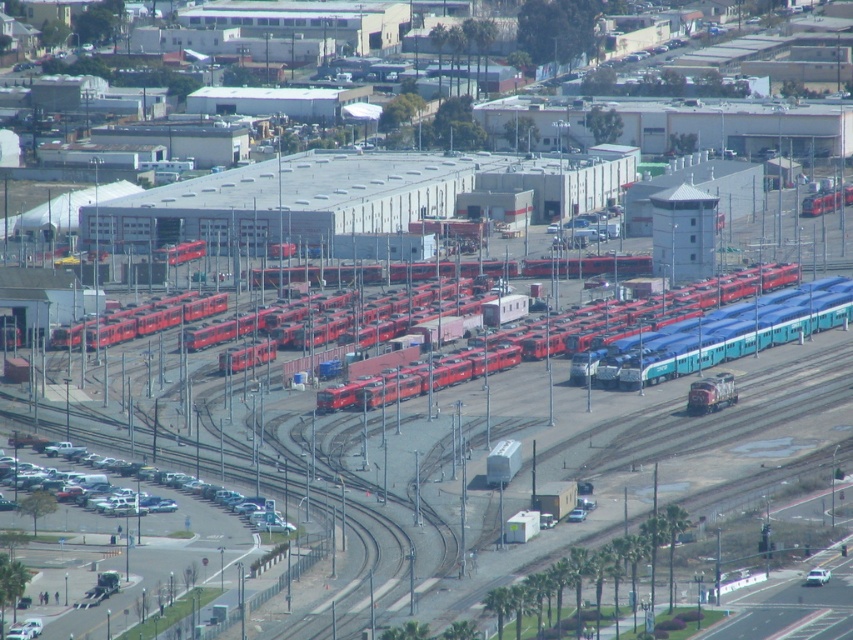
Question: Is matte red train at left positioned at the back of reddish-brown metallic train car at lower right?

Choices:
 (A) no
 (B) yes

Answer: (A)

Question: Which point is farther from the camera taking this photo?

Choices:
 (A) (525, 344)
 (B) (810, 321)
 (C) (726, 401)
 (D) (78, 330)

Answer: (B)

Question: Can you confirm if matte red train at center is wider than matte red train at left?

Choices:
 (A) yes
 (B) no

Answer: (A)

Question: Does matte red train at center appear on the right side of reddish-brown metallic train car at lower right?

Choices:
 (A) no
 (B) yes

Answer: (A)

Question: Which object is closer to the camera taking this photo?

Choices:
 (A) matte red train at left
 (B) reddish-brown metallic train car at lower right
 (C) red glossy train at center

Answer: (A)

Question: Which point is farther to the camera?

Choices:
 (A) matte red train at center
 (B) red glossy train at center
 (C) reddish-brown metallic train car at lower right
 (D) matte red train at left

Answer: (B)